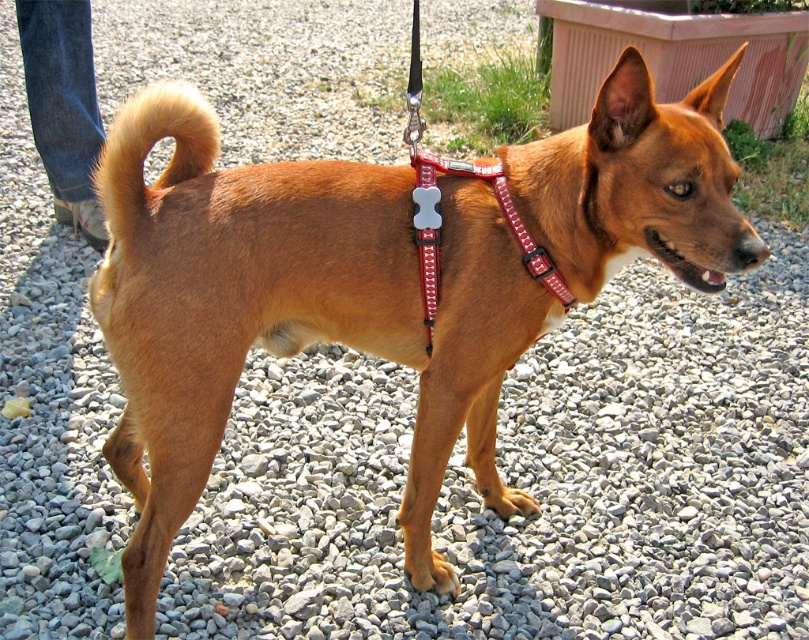
Is golden fur tail at upper left to the right of red fabric bone-shaped collar at center from the viewer's perspective?

Incorrect, golden fur tail at upper left is not on the right side of red fabric bone-shaped collar at center.

Between point (123, 236) and point (424, 289), which one is positioned behind?

The point (424, 289) is behind.

Which is behind, point (117, 236) or point (416, 193)?

Point (416, 193)

At what (x,y) coordinates should I click in order to perform the action: click on golden fur tail at upper left. Please return your answer as a coordinate pair (x, y). This screenshot has height=640, width=809. Looking at the image, I should click on (149, 148).